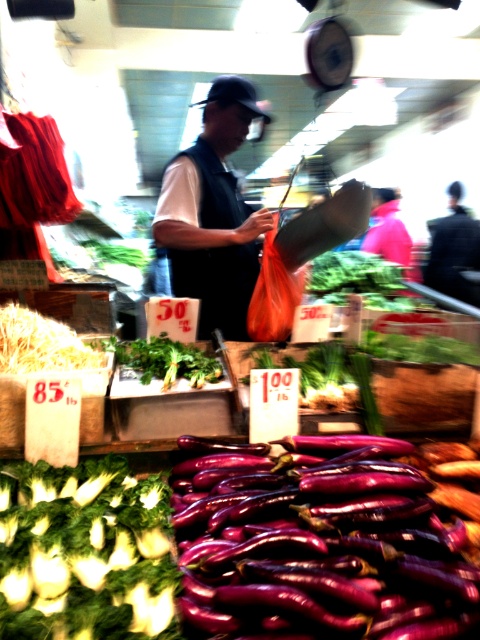
Is dark blue vest at center taller than green leafy at center?

Indeed, dark blue vest at center has a greater height compared to green leafy at center.

Does dark blue vest at center appear on the right side of green leafy at center?

Yes, dark blue vest at center is to the right of green leafy at center.

Find the location of a particular element. The height and width of the screenshot is (640, 480). dark blue vest at center is located at coordinates (214, 214).

At what (x,y) coordinates should I click in order to perform the action: click on dark blue vest at center. Please return your answer as a coordinate pair (x, y). Looking at the image, I should click on (214, 214).

Does point (31, 467) lie behind point (181, 150)?

No, (31, 467) is in front of (181, 150).

This screenshot has height=640, width=480. I want to click on green leafy at lower left, so click(84, 552).

Between green leafy at lower left and dark blue jeans at center, which one is positioned lower?

green leafy at lower left is below.

Which is behind, point (19, 579) or point (451, 282)?

The point (451, 282) is behind.

The width and height of the screenshot is (480, 640). In order to click on green leafy at lower left in this screenshot , I will do `click(84, 552)`.